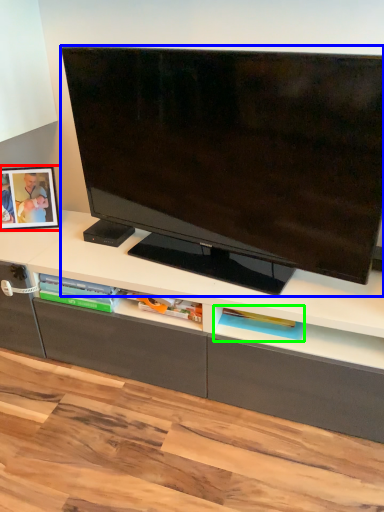
Question: Considering the real-world distances, which object is closest to picture frame (highlighted by a red box)? television (highlighted by a blue box) or shelf (highlighted by a green box).

Choices:
 (A) television
 (B) shelf

Answer: (A)